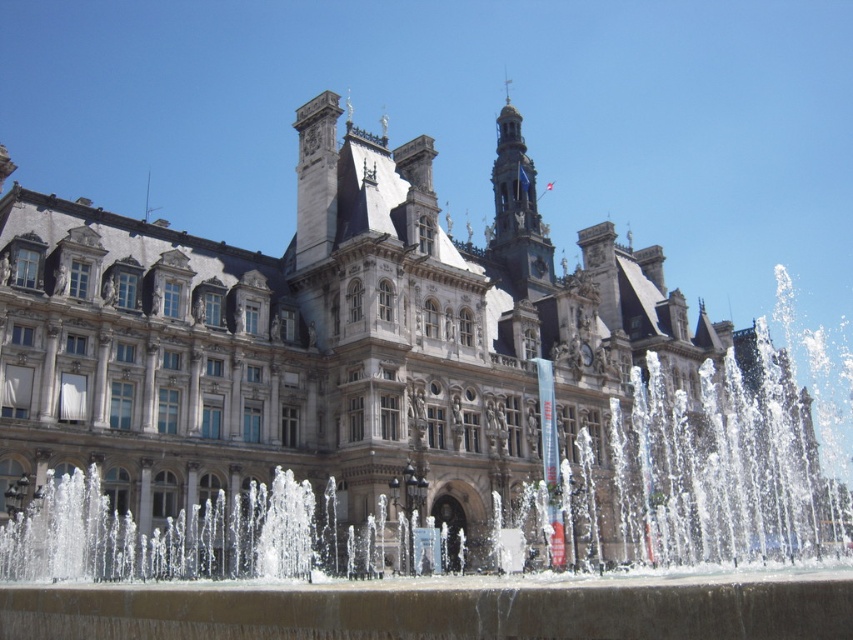
Who is higher up, clear water at center or gray stone tower at upper center?

gray stone tower at upper center

Between clear water at center and gray stone tower at upper center, which one has more height?

gray stone tower at upper center is taller.

Is point (619, 404) positioned in front of point (517, 204)?

Yes, point (619, 404) is closer to viewer.

The image size is (853, 640). Identify the location of clear water at center. (434, 612).